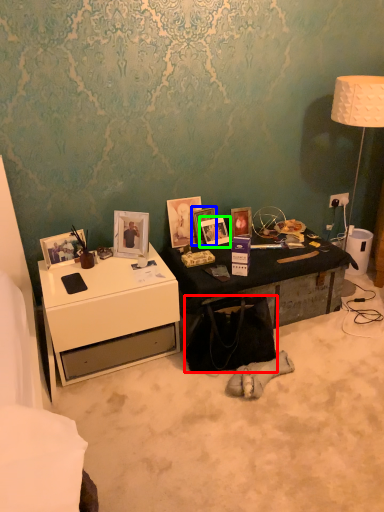
Question: Which is farther away from handbag (highlighted by a red box)? picture frame (highlighted by a blue box) or picture frame (highlighted by a green box)?

Choices:
 (A) picture frame
 (B) picture frame

Answer: (A)